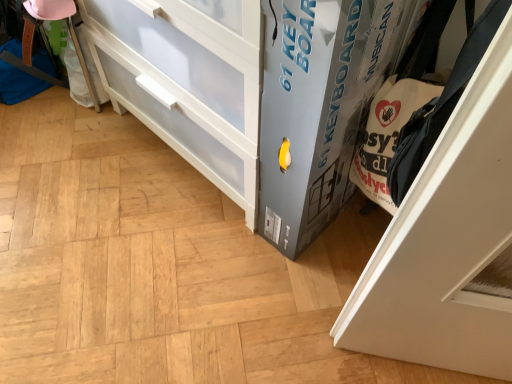
Question: In terms of size, does white matte door at right appear bigger or smaller than gray cardboard box at lower right?

Choices:
 (A) big
 (B) small

Answer: (B)

Question: Considering their positions, is white matte door at right located in front of or behind gray cardboard box at lower right?

Choices:
 (A) behind
 (B) front

Answer: (B)

Question: Does point (495, 122) appear closer or farther from the camera than point (349, 130)?

Choices:
 (A) farther
 (B) closer

Answer: (B)

Question: From their relative heights in the image, would you say gray cardboard box at lower right is taller or shorter than white matte door at right?

Choices:
 (A) tall
 (B) short

Answer: (A)

Question: In the image, is gray cardboard box at lower right positioned in front of or behind white matte door at right?

Choices:
 (A) behind
 (B) front

Answer: (A)

Question: In terms of size, does gray cardboard box at lower right appear bigger or smaller than white matte door at right?

Choices:
 (A) small
 (B) big

Answer: (B)

Question: Choose the correct answer: Is gray cardboard box at lower right inside white matte door at right or outside it?

Choices:
 (A) outside
 (B) inside

Answer: (A)